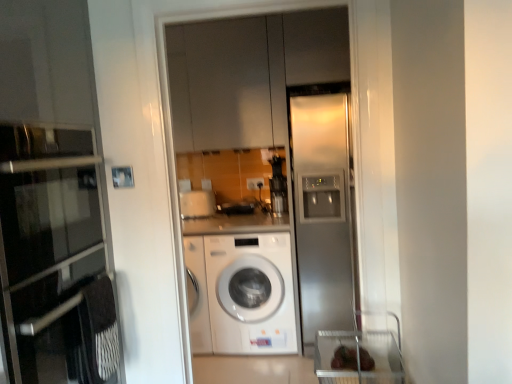
Question: Does stainless steel refrigerator at right have a larger size compared to satin silver refrigerator at center?

Choices:
 (A) yes
 (B) no

Answer: (A)

Question: Does stainless steel refrigerator at right have a greater height compared to satin silver refrigerator at center?

Choices:
 (A) yes
 (B) no

Answer: (A)

Question: Considering the relative sizes of stainless steel refrigerator at right and satin silver refrigerator at center in the image provided, is stainless steel refrigerator at right wider than satin silver refrigerator at center?

Choices:
 (A) yes
 (B) no

Answer: (A)

Question: Does stainless steel refrigerator at right have a smaller size compared to satin silver refrigerator at center?

Choices:
 (A) yes
 (B) no

Answer: (B)

Question: From the image's perspective, does stainless steel refrigerator at right appear lower than satin silver refrigerator at center?

Choices:
 (A) yes
 (B) no

Answer: (A)

Question: From the image's perspective, would you say stainless steel refrigerator at right is positioned over satin silver refrigerator at center?

Choices:
 (A) yes
 (B) no

Answer: (B)

Question: From a real-world perspective, is matte glass oven at left beneath white glossy washing machine at center?

Choices:
 (A) yes
 (B) no

Answer: (B)

Question: From the image's perspective, would you say matte glass oven at left is positioned over white glossy washing machine at center?

Choices:
 (A) yes
 (B) no

Answer: (A)

Question: Does matte glass oven at left come in front of white glossy washing machine at center?

Choices:
 (A) yes
 (B) no

Answer: (A)

Question: Is matte glass oven at left behind white glossy washing machine at center?

Choices:
 (A) no
 (B) yes

Answer: (A)

Question: Considering the relative sizes of matte glass oven at left and white glossy washing machine at center in the image provided, is matte glass oven at left thinner than white glossy washing machine at center?

Choices:
 (A) yes
 (B) no

Answer: (A)

Question: Considering the relative positions of matte glass oven at left and white glossy washing machine at center in the image provided, is matte glass oven at left to the right of white glossy washing machine at center from the viewer's perspective?

Choices:
 (A) no
 (B) yes

Answer: (A)

Question: Considering the relative positions of satin silver refrigerator at center and matte glass oven at left in the image provided, is satin silver refrigerator at center to the left of matte glass oven at left from the viewer's perspective?

Choices:
 (A) yes
 (B) no

Answer: (B)